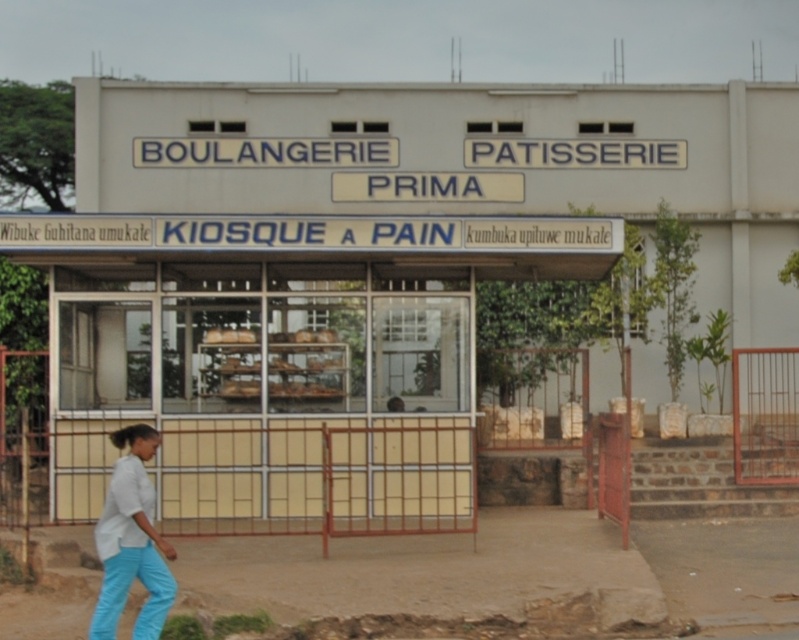
You are a customer standing in front of the bakery. You see the matte yellow kiosk at center and the white fabric pants at lower left. Which object is closer to you?

The matte yellow kiosk at center is closer to you because it is positioned over the white fabric pants at lower left, indicating it is in front.

You are a customer standing in front of the bakery and see the point marked at coordinates (281, 371). What object is located at that point?

The point at coordinates (281, 371) is occupied by the matte yellow kiosk at center.

In the scene shown: You are a customer standing at the entrance of the bakery. You see the matte yellow kiosk at center and the white fabric pants at lower left. How far apart are these two items from each other?

The matte yellow kiosk at center and white fabric pants at lower left are 6.05 meters apart.